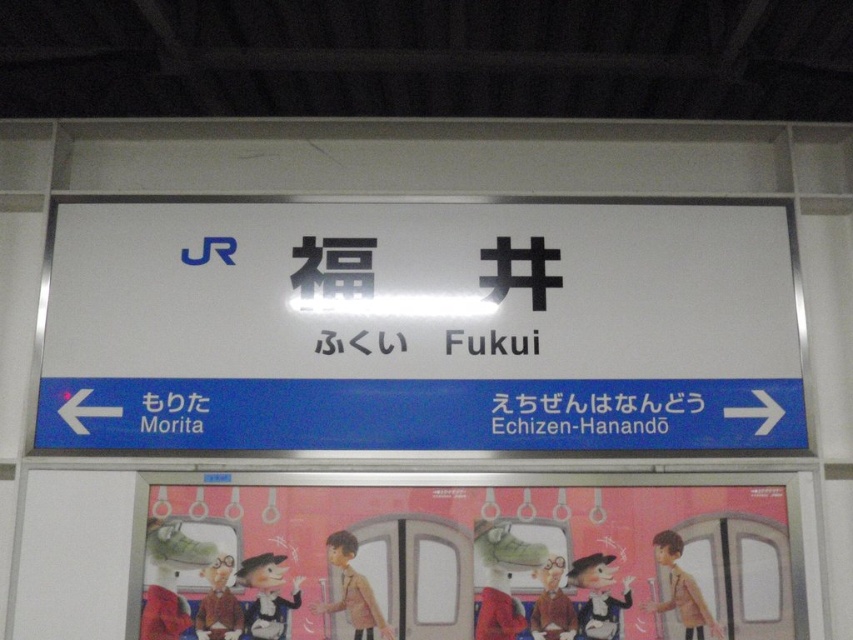
Question: Does white plastic sign at center appear over cartoon characters at center?

Choices:
 (A) yes
 (B) no

Answer: (A)

Question: Among these points, which one is nearest to the camera?

Choices:
 (A) (192, 548)
 (B) (434, 298)

Answer: (A)

Question: Does white plastic sign at center appear under cartoon characters at center?

Choices:
 (A) yes
 (B) no

Answer: (B)

Question: Among these objects, which one is farthest from the camera?

Choices:
 (A) white plastic sign at center
 (B) cartoon characters at center

Answer: (A)

Question: Is white plastic sign at center above cartoon characters at center?

Choices:
 (A) no
 (B) yes

Answer: (B)

Question: Which object appears farthest from the camera in this image?

Choices:
 (A) white plastic sign at center
 (B) cartoon characters at center

Answer: (A)